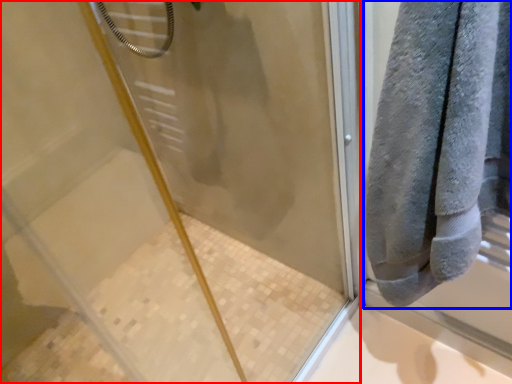
Question: Which object appears closest to the camera in this image, screen door (highlighted by a red box) or towel (highlighted by a blue box)?

Choices:
 (A) screen door
 (B) towel

Answer: (A)